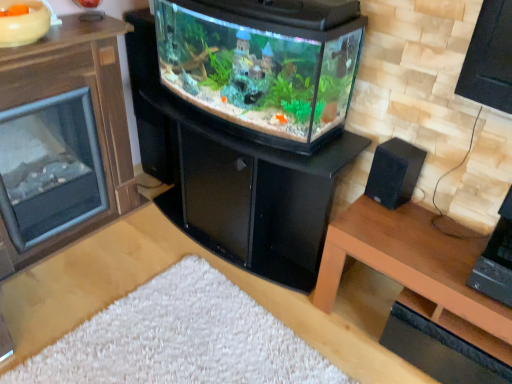
The height and width of the screenshot is (384, 512). Find the location of `vacant area that lies to the right of black matte speaker at right`. vacant area that lies to the right of black matte speaker at right is located at coordinates (428, 211).